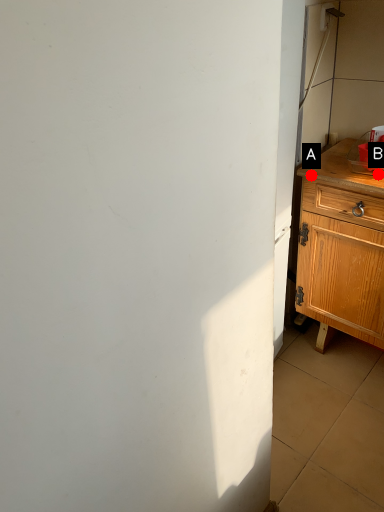
Question: Two points are circled on the image, labeled by A and B beside each circle. Which point is closer to the camera taking this photo?

Choices:
 (A) A is closer
 (B) B is closer

Answer: (B)